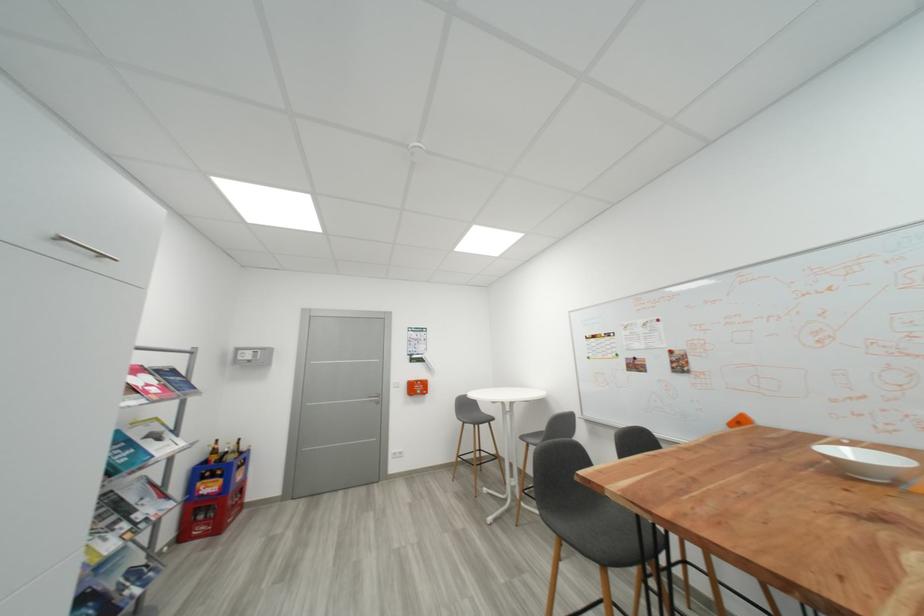
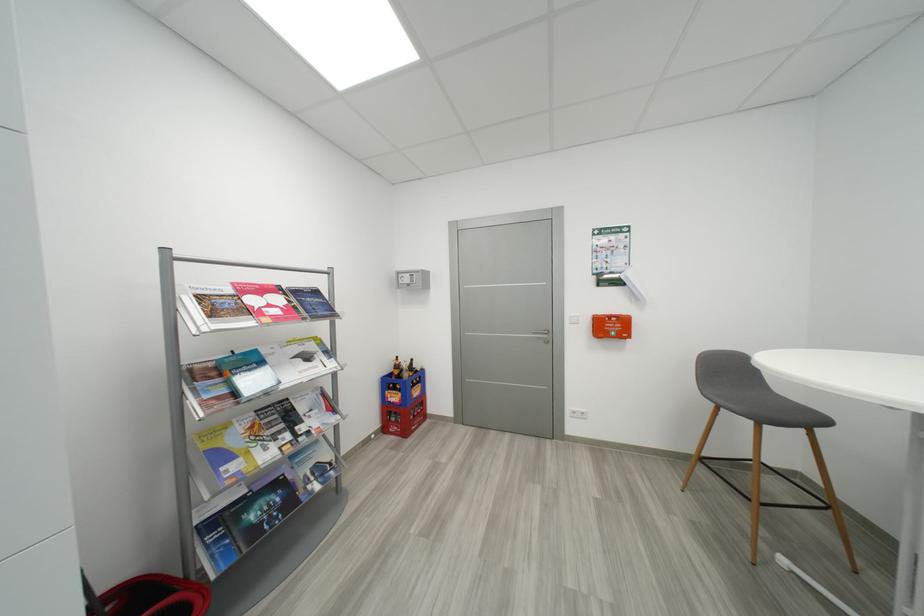
Locate, in the second image, the point that corresponds to pixel 130 527 in the first image.

(294, 438)